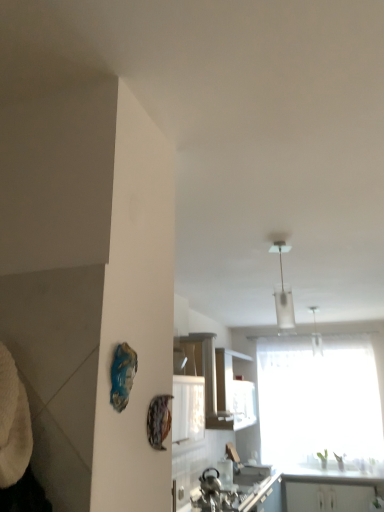
Question: Is white glass pendant light at upper center not inside white glossy cabinet at center, which appears as the second cabinetry when ordered from the bottom?

Choices:
 (A) yes
 (B) no

Answer: (A)

Question: Is white glossy cabinet at center, the first cabinetry from the front, a part of white glass pendant light at upper center?

Choices:
 (A) yes
 (B) no

Answer: (B)

Question: Is white glass pendant light at upper center next to white glossy cabinet at center, the first cabinetry from the front?

Choices:
 (A) no
 (B) yes

Answer: (A)

Question: From the image's perspective, is white glass pendant light at upper center under white glossy cabinet at center, which appears as the second cabinetry when ordered from the bottom?

Choices:
 (A) yes
 (B) no

Answer: (B)

Question: Is white glossy cabinet at center, which ranks as the 2th cabinetry in back-to-front order, at the back of white glass pendant light at upper center?

Choices:
 (A) no
 (B) yes

Answer: (A)

Question: Could you tell me if white glass pendant light at upper center is facing white glossy cabinet at center, which ranks as the 2th cabinetry in back-to-front order?

Choices:
 (A) no
 (B) yes

Answer: (A)

Question: Are white glossy countertop at lower right and white glossy cabinet at lower right, the 1th cabinetry positioned from the back, located far from each other?

Choices:
 (A) yes
 (B) no

Answer: (B)

Question: Does white glossy countertop at lower right have a smaller size compared to white glossy cabinet at lower right, arranged as the 2th cabinetry when viewed from the left?

Choices:
 (A) yes
 (B) no

Answer: (B)

Question: Can you confirm if white glossy countertop at lower right is thinner than white glossy cabinet at lower right, arranged as the 1th cabinetry when viewed from the right?

Choices:
 (A) no
 (B) yes

Answer: (A)

Question: From a real-world perspective, is white glossy countertop at lower right located beneath white glossy cabinet at lower right, placed as the second cabinetry when sorted from top to bottom?

Choices:
 (A) no
 (B) yes

Answer: (A)

Question: Does white glossy countertop at lower right touch white glossy cabinet at lower right, placed as the second cabinetry when sorted from top to bottom?

Choices:
 (A) no
 (B) yes

Answer: (A)

Question: From the image's perspective, is white glossy countertop at lower right over white glossy cabinet at lower right, arranged as the 1th cabinetry when viewed from the right?

Choices:
 (A) yes
 (B) no

Answer: (A)

Question: Are transparent fabric window at center and white glossy cabinet at center, which is counted as the first cabinetry, starting from the left, far apart?

Choices:
 (A) no
 (B) yes

Answer: (B)